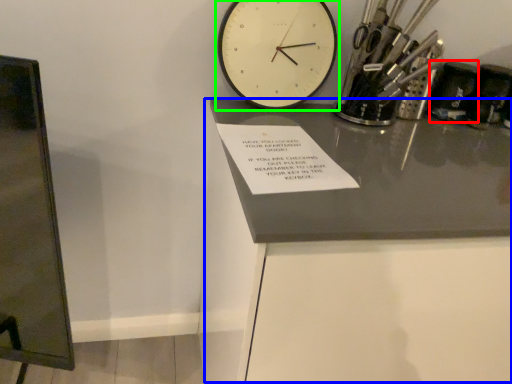
Question: Estimate the real-world distances between objects in this image. Which object is closer to stationery (highlighted by a red box), table (highlighted by a blue box) or wall clock (highlighted by a green box)?

Choices:
 (A) table
 (B) wall clock

Answer: (B)